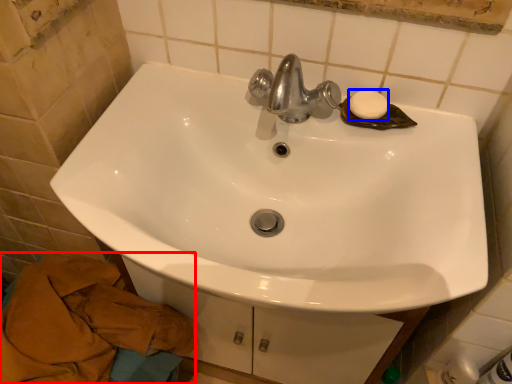
Question: Which object appears closest to the camera in this image, bath towel (highlighted by a red box) or soap (highlighted by a blue box)?

Choices:
 (A) bath towel
 (B) soap

Answer: (A)